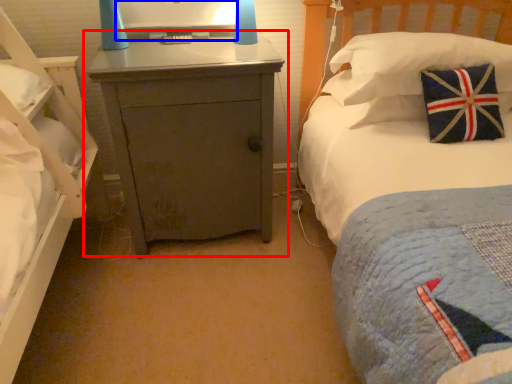
Question: Among these objects, which one is farthest to the camera, nightstand (highlighted by a red box) or computer monitor (highlighted by a blue box)?

Choices:
 (A) nightstand
 (B) computer monitor

Answer: (B)